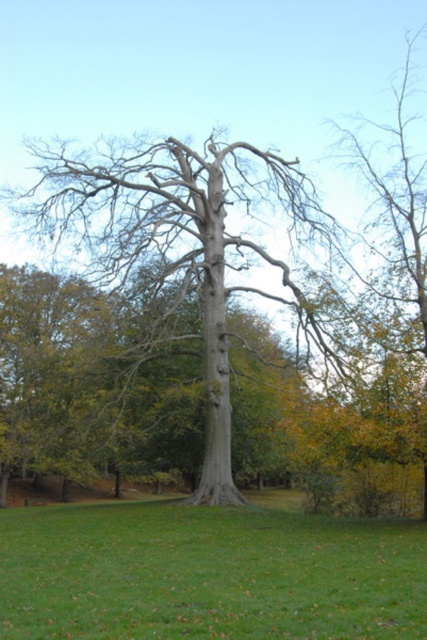
You are standing in the park and see two points marked in the image. The first point is at coordinates point (333, 616) and the second is at point (192, 154). If you were to walk from the first point to the second, would you be moving towards the background or the foreground of the image?

The point (333, 616) is in front of point (192, 154). Therefore, moving from the first point to the second would mean moving towards the background of the image.

You are standing in the park and see the gray bark tree at center and the green grass at center. Which object is located to the right of the other?

The green grass at center is to the right of the gray bark tree at center.

You are standing at the point marked as point (207, 573) in the image. What do you see directly beneath your feet?

At point (207, 573) lies green grass at center.